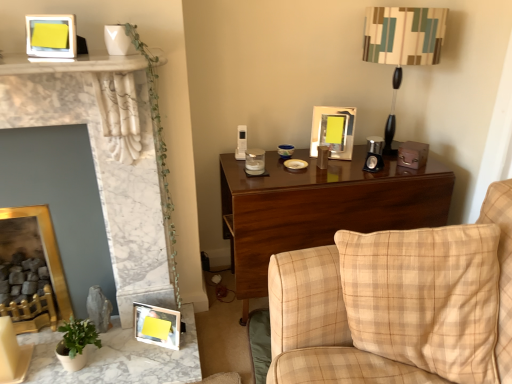
Image resolution: width=512 pixels, height=384 pixels. In order to click on free space between white marble fireplace at left and green matte plant at lower left in this screenshot , I will do `click(91, 357)`.